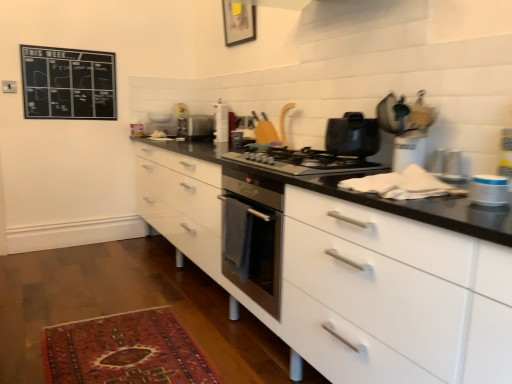
Image resolution: width=512 pixels, height=384 pixels. What do you see at coordinates (124, 351) in the screenshot?
I see `carpeted rug at lower left` at bounding box center [124, 351].

What do you see at coordinates (238, 22) in the screenshot? I see `wooden picture frame at upper center` at bounding box center [238, 22].

What do you see at coordinates (302, 161) in the screenshot? This screenshot has width=512, height=384. I see `satin black gas stove at center` at bounding box center [302, 161].

You are a GUI agent. You are given a task and a screenshot of the screen. Output one action in this format:
    pyautogui.click(x=<x>, y=<y>)
    Task: Click on the satin black gas stove at center
    The width and height of the screenshot is (512, 384).
    Given the screenshot: What is the action you would take?
    pyautogui.click(x=302, y=161)

In order to face white glossy toaster at center, the 2th appliance from the left, should I rotate leftwards or rightwards?

Turn left approximately 4.741 degrees to face it.

At what (x,y) coordinates should I click in order to perform the action: click on black chalkboard at upper left. Please return your answer as a coordinate pair (x, y). Looking at the image, I should click on (68, 83).

The height and width of the screenshot is (384, 512). Describe the element at coordinates (352, 135) in the screenshot. I see `shiny black pot at center` at that location.

Where is `carpeted rug at lower left`? This screenshot has width=512, height=384. carpeted rug at lower left is located at coordinates (124, 351).

Considering the relative positions of wooden picture frame at upper center and white glossy toaster at center, the 3th appliance positioned from the bottom, in the image provided, is wooden picture frame at upper center to the left of white glossy toaster at center, the 3th appliance positioned from the bottom, from the viewer's perspective?

No, wooden picture frame at upper center is not to the left of white glossy toaster at center, the 3th appliance positioned from the bottom.

Is point (233, 42) closer or farther from the camera than point (218, 135)?

Clearly, point (233, 42) is more distant from the camera than point (218, 135).

Is wooden picture frame at upper center shorter than white glossy toaster at center, which is counted as the third appliance, starting from the front?

No, wooden picture frame at upper center is not shorter than white glossy toaster at center, which is counted as the third appliance, starting from the front.

Measure the distance from wooden picture frame at upper center to white glossy toaster at center, placed as the 2th appliance when sorted from top to bottom.

24.08 inches.

Based on the photo, how many degrees apart are the facing directions of white matte container at upper right, which is the second appliance from right to left, and shiny black pot at center?

There is a 1.79-degree angle between the facing directions of white matte container at upper right, which is the second appliance from right to left, and shiny black pot at center.

Considering the relative positions of white matte container at upper right, which is counted as the 2th appliance, starting from the front, and shiny black pot at center in the image provided, is white matte container at upper right, which is counted as the 2th appliance, starting from the front, behind shiny black pot at center?

No, it is not.

Image resolution: width=512 pixels, height=384 pixels. Identify the location of kitchen appliance that is on the left side of white matte container at upper right, marked as the third appliance in a back-to-front arrangement. (352, 135).

Does point (404, 159) appear closer or farther from the camera than point (344, 151)?

Clearly, point (404, 159) is closer to the camera than point (344, 151).

Is satin silver toaster at center, placed as the 4th appliance when sorted from right to left, surrounded by satin black gas stove at center?

No, satin black gas stove at center does not contain satin silver toaster at center, placed as the 4th appliance when sorted from right to left.

From the image's perspective, is satin black gas stove at center positioned above or below satin silver toaster at center, placed as the 4th appliance when sorted from right to left?

From the image's perspective, satin black gas stove at center appears below satin silver toaster at center, placed as the 4th appliance when sorted from right to left.

Considering the relative positions of satin black gas stove at center and satin silver toaster at center, which is counted as the 1th appliance, starting from the left, in the image provided, is satin black gas stove at center behind satin silver toaster at center, which is counted as the 1th appliance, starting from the left,?

No, satin black gas stove at center is closer to the viewer.

Does shiny black pot at center have a greater width compared to satin silver toaster at center, the 4th appliance in the bottom-to-top sequence?

In fact, shiny black pot at center might be narrower than satin silver toaster at center, the 4th appliance in the bottom-to-top sequence.

Is shiny black pot at center not near satin silver toaster at center, which is counted as the 1th appliance, starting from the top?

shiny black pot at center is positioned a significant distance from satin silver toaster at center, which is counted as the 1th appliance, starting from the top.

Is shiny black pot at center bigger than satin silver toaster at center, the 4th appliance viewed from the front?

Incorrect, shiny black pot at center is not larger than satin silver toaster at center, the 4th appliance viewed from the front.

From the picture: Which of these two, shiny black pot at center or satin black gas stove at center, stands taller?

shiny black pot at center.

Is shiny black pot at center wider or thinner than satin black gas stove at center?

In the image, shiny black pot at center appears to be more narrow than satin black gas stove at center.

Which is more to the left, shiny black pot at center or satin black gas stove at center?

Positioned to the left is satin black gas stove at center.

Between shiny black pot at center and wooden picture frame at upper center, which one is positioned behind?

wooden picture frame at upper center is behind.

What's the angular difference between shiny black pot at center and wooden picture frame at upper center's facing directions?

The angle between the facing direction of shiny black pot at center and the facing direction of wooden picture frame at upper center is 1.32 degrees.

Is shiny black pot at center next to wooden picture frame at upper center?

No, shiny black pot at center is not making contact with wooden picture frame at upper center.

Is shiny black pot at center looking in the opposite direction of wooden picture frame at upper center?

No, shiny black pot at center's orientation is not away from wooden picture frame at upper center.

Between point (331, 157) and point (159, 345), which one is positioned in front?

Point (331, 157)

From a real-world perspective, is satin black gas stove at center under carpeted rug at lower left?

No, from a real-world perspective, satin black gas stove at center is not below carpeted rug at lower left.

Based on their sizes in the image, would you say satin black gas stove at center is bigger or smaller than carpeted rug at lower left?

Clearly, satin black gas stove at center is larger in size than carpeted rug at lower left.

How distant is satin black gas stove at center from carpeted rug at lower left?

satin black gas stove at center and carpeted rug at lower left are 3.45 feet apart from each other.

At what (x,y) coordinates should I click in order to perform the action: click on appliance that is the 1st object directly below the wooden picture frame at upper center (from a real-world perspective). Please return your answer as a coordinate pair (x, y). This screenshot has width=512, height=384. Looking at the image, I should click on (221, 122).

From the image's perspective, count 1st appliances downward from the shiny black pot at center and point to it. Please provide its 2D coordinates.

[(409, 150)]

Which object lies further to the anchor point satin silver toaster at center, positioned as the first appliance in back-to-front order, carpeted rug at lower left or satin black gas stove at center?

Based on the image, carpeted rug at lower left appears to be further to satin silver toaster at center, positioned as the first appliance in back-to-front order.

Based on their spatial positions, is white matte container at upper right, which is counted as the third appliance, starting from the left, or wooden picture frame at upper center closer to white plastic container at right, positioned as the 1th appliance in front-to-back order?

white matte container at upper right, which is counted as the third appliance, starting from the left.

Based on their spatial positions, is white glossy toaster at center, the 2th appliance from the left, or wooden picture frame at upper center closer to black chalkboard at upper left?

white glossy toaster at center, the 2th appliance from the left, is closer to black chalkboard at upper left.

Based on their spatial positions, is wooden picture frame at upper center or white plastic container at right, acting as the fourth appliance starting from the back, further from white glossy toaster at center, the 3th appliance positioned from the bottom?

The object further to white glossy toaster at center, the 3th appliance positioned from the bottom, is white plastic container at right, acting as the fourth appliance starting from the back.

When comparing their distances from satin black gas stove at center, does shiny black pot at center or carpeted rug at lower left seem closer?

Based on the image, shiny black pot at center appears to be nearer to satin black gas stove at center.

Looking at the image, which one is located closer to satin silver toaster at center, which is counted as the 1th appliance, starting from the left, white plastic container at right, positioned as the 1th appliance in front-to-back order, or shiny black pot at center?

Among the two, shiny black pot at center is located nearer to satin silver toaster at center, which is counted as the 1th appliance, starting from the left.

Based on their spatial positions, is white plastic container at right, the fourth appliance from the top, or black chalkboard at upper left closer to white glossy toaster at center, which appears as the 3th appliance when viewed from the right?

black chalkboard at upper left lies closer to white glossy toaster at center, which appears as the 3th appliance when viewed from the right, than the other object.

Looking at the image, which one is located further to white glossy toaster at center, placed as the 2th appliance when sorted from top to bottom, satin silver toaster at center, placed as the 4th appliance when sorted from right to left, or shiny black pot at center?

shiny black pot at center lies further to white glossy toaster at center, placed as the 2th appliance when sorted from top to bottom, than the other object.

This screenshot has width=512, height=384. I want to click on kitchen appliance between white plastic container at right, positioned as the 1th appliance in front-to-back order, and white glossy toaster at center, the 2th appliance from the left, from front to back, so click(x=352, y=135).

Where is `kitchen appliance between black chalkboard at upper left and white plastic container at right, which is the first appliance in bottom-to-top order`? kitchen appliance between black chalkboard at upper left and white plastic container at right, which is the first appliance in bottom-to-top order is located at coordinates (352, 135).

Where is `kitchen appliance between carpeted rug at lower left and white plastic container at right, the fourth appliance from the top, from left to right`? The height and width of the screenshot is (384, 512). kitchen appliance between carpeted rug at lower left and white plastic container at right, the fourth appliance from the top, from left to right is located at coordinates (352, 135).

At what (x,y) coordinates should I click in order to perform the action: click on picture frame between white plastic container at right, acting as the fourth appliance starting from the back, and white glossy toaster at center, the 3th appliance positioned from the bottom, from front to back. Please return your answer as a coordinate pair (x, y). This screenshot has height=384, width=512. Looking at the image, I should click on (238, 22).